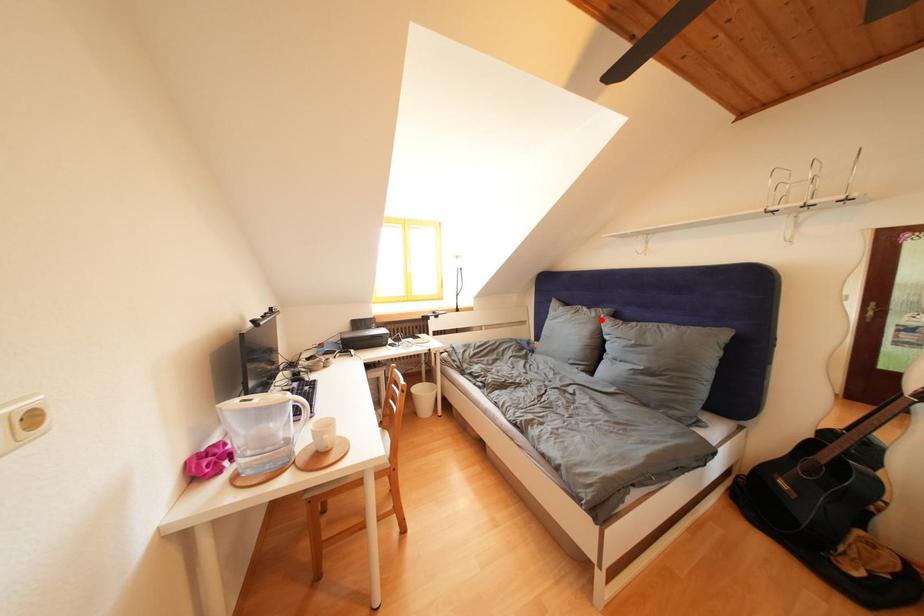
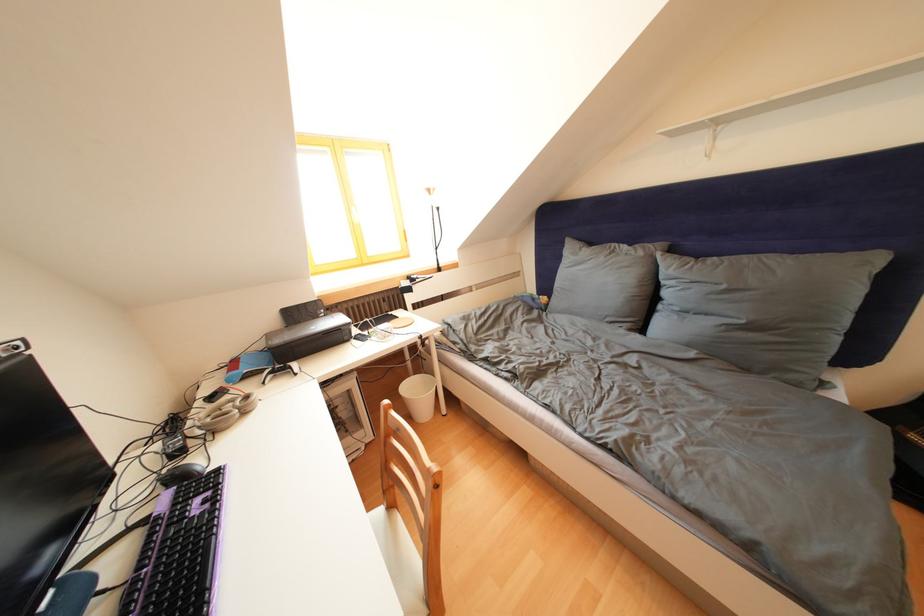
The point at the highlighted location is marked in the first image. Where is the corresponding point in the second image?

(649, 259)